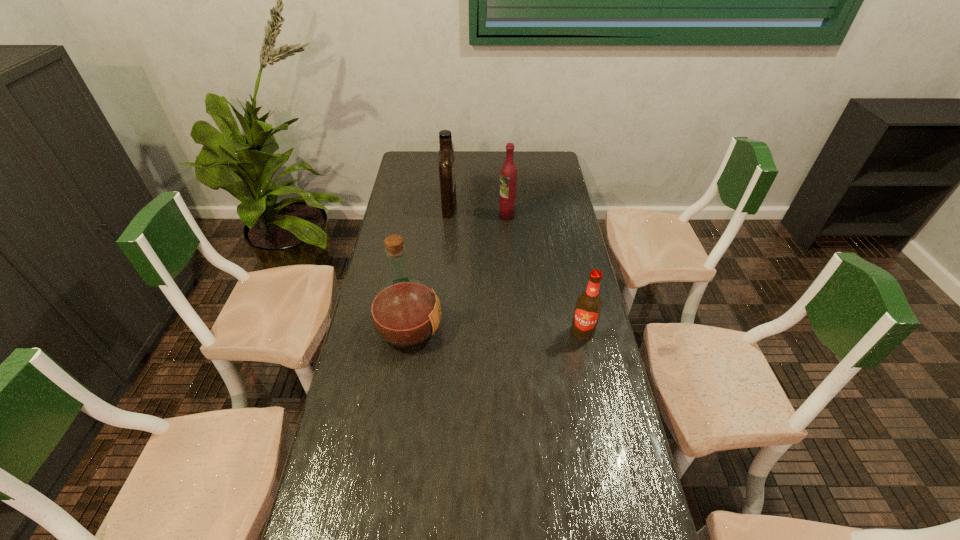
At what (x,y) coordinates should I click in order to perform the action: click on object positioned at the right edge. Please return your answer as a coordinate pair (x, y). This screenshot has height=540, width=960. Looking at the image, I should click on (588, 306).

I want to click on vacant space at the far edge of the desktop, so click(521, 167).

Find the location of a particular element. vacant space at the left edge of the desktop is located at coordinates (415, 252).

The image size is (960, 540). Identify the location of vacant space at the right edge of the desktop. (577, 288).

Locate an element on the screen. Image resolution: width=960 pixels, height=540 pixels. vacant position at the far right corner of the desktop is located at coordinates (546, 168).

Locate an element on the screen. This screenshot has height=540, width=960. free point between the shortest object and the second object from right to left is located at coordinates point(544,274).

Locate an element on the screen. empty location between the third object from left to right and the nearest liquor is located at coordinates (458, 273).

In order to click on free space between the second object from right to left and the beer bottle in this screenshot , I will do `click(544, 274)`.

Where is `free space between the rightmost object and the nearest liquor`? free space between the rightmost object and the nearest liquor is located at coordinates (495, 331).

Point out which object is positioned as the second nearest to the rightmost object. Please provide its 2D coordinates. Your answer should be formatted as a tuple, i.e. [(x, y)], where the tuple contains the x and y coordinates of a point satisfying the conditions above.

[(508, 176)]